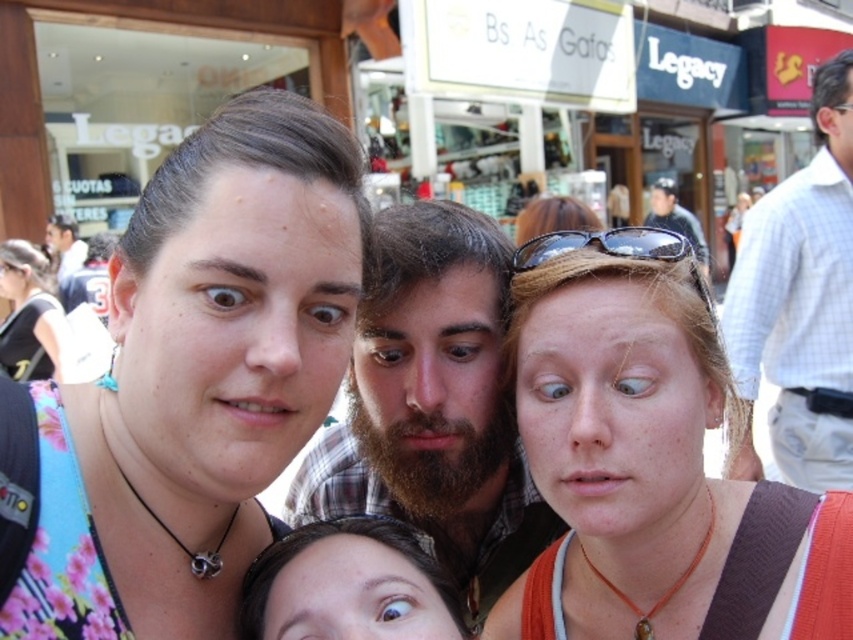
You are standing in the street scene and want to find the white checkered shirt at right. According to the coordinates provided, where should you look relative to the main group of people taking a selfie?

The white checkered shirt at right is located at coordinates point [802,296], which is to the right side of the main group of people taking a selfie.

Looking at the group of people taking a selfie in the street scene, which person has wider hair? The smooth brown hair at center or the matte black hair at left?

The smooth brown hair at center has a wider width than the matte black hair at left.